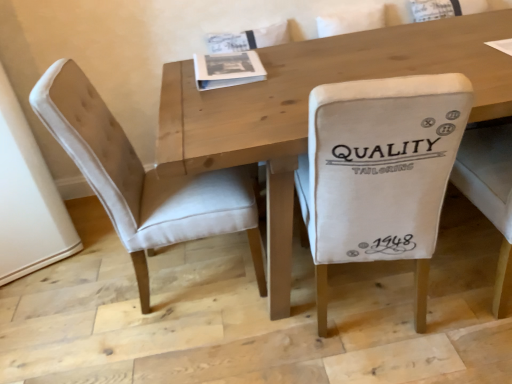
The height and width of the screenshot is (384, 512). In order to click on free point to the right of white paper book at center in this screenshot , I will do `click(295, 52)`.